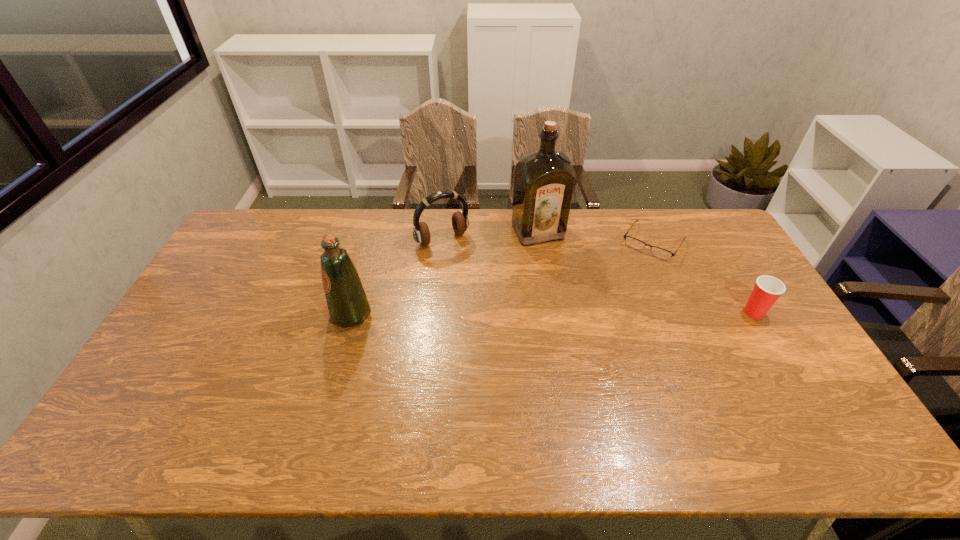
You are a GUI agent. You are given a task and a screenshot of the screen. Output one action in this format:
    pyautogui.click(x=<x>, y=<y>)
    Task: Click on the leftmost object
    Image resolution: width=960 pixels, height=540 pixels.
    Given the screenshot: What is the action you would take?
    pyautogui.click(x=348, y=306)

Identify the location of olive oil. (348, 306).

Identify the location of the rightmost object. (767, 289).

This screenshot has height=540, width=960. Identify the location of the fourth tallest object. (767, 289).

Find the location of a particular element. the shortest object is located at coordinates (632, 242).

Image resolution: width=960 pixels, height=540 pixels. What are the coordinates of `the second object from right to left` in the screenshot? It's located at (632, 242).

Identify the location of the fourth object from right to left. (460, 223).

At what (x,y) coordinates should I click in order to perform the action: click on headset. Please return your answer as a coordinate pair (x, y). Looking at the image, I should click on point(460,223).

Find the location of `the third object from right to left`. the third object from right to left is located at coordinates (544, 180).

Locate an element on the screen. The height and width of the screenshot is (540, 960). liquor is located at coordinates tap(544, 180).